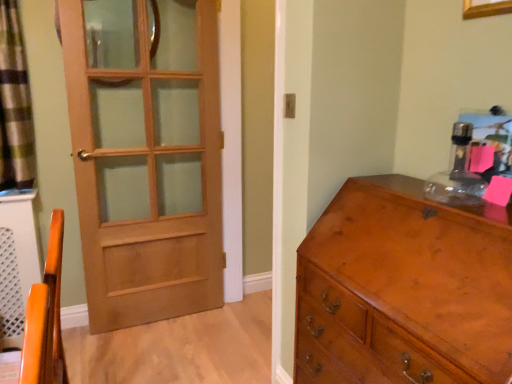
Question: Does shiny brown wooden chest of drawers at right have a lesser width compared to green plaid curtain at left?

Choices:
 (A) no
 (B) yes

Answer: (A)

Question: Is shiny brown wooden chest of drawers at right smaller than green plaid curtain at left?

Choices:
 (A) no
 (B) yes

Answer: (A)

Question: Considering the relative positions of shiny brown wooden chest of drawers at right and green plaid curtain at left in the image provided, is shiny brown wooden chest of drawers at right to the left of green plaid curtain at left from the viewer's perspective?

Choices:
 (A) yes
 (B) no

Answer: (B)

Question: Does shiny brown wooden chest of drawers at right lie in front of green plaid curtain at left?

Choices:
 (A) no
 (B) yes

Answer: (B)

Question: Can you confirm if shiny brown wooden chest of drawers at right is positioned to the right of green plaid curtain at left?

Choices:
 (A) no
 (B) yes

Answer: (B)

Question: Based on their sizes in the image, would you say shiny brown wooden chest of drawers at right is bigger or smaller than light brown wood door at left?

Choices:
 (A) small
 (B) big

Answer: (B)

Question: From a real-world perspective, is shiny brown wooden chest of drawers at right physically located above or below light brown wood door at left?

Choices:
 (A) below
 (B) above

Answer: (A)

Question: From the image's perspective, is shiny brown wooden chest of drawers at right positioned above or below light brown wood door at left?

Choices:
 (A) below
 (B) above

Answer: (A)

Question: In the image, is shiny brown wooden chest of drawers at right on the left side or the right side of light brown wood door at left?

Choices:
 (A) right
 (B) left

Answer: (A)

Question: From the image's perspective, relative to shiny brown wooden chest of drawers at right, is green plaid curtain at left above or below?

Choices:
 (A) above
 (B) below

Answer: (A)

Question: Considering their positions, is green plaid curtain at left located in front of or behind shiny brown wooden chest of drawers at right?

Choices:
 (A) behind
 (B) front

Answer: (A)

Question: Is green plaid curtain at left to the left or to the right of shiny brown wooden chest of drawers at right in the image?

Choices:
 (A) right
 (B) left

Answer: (B)

Question: Considering the positions of green plaid curtain at left and shiny brown wooden chest of drawers at right in the image, is green plaid curtain at left wider or thinner than shiny brown wooden chest of drawers at right?

Choices:
 (A) thin
 (B) wide

Answer: (A)

Question: Would you say green plaid curtain at left is inside or outside light brown wood door at left?

Choices:
 (A) inside
 (B) outside

Answer: (B)

Question: Is green plaid curtain at left taller or shorter than light brown wood door at left?

Choices:
 (A) short
 (B) tall

Answer: (A)